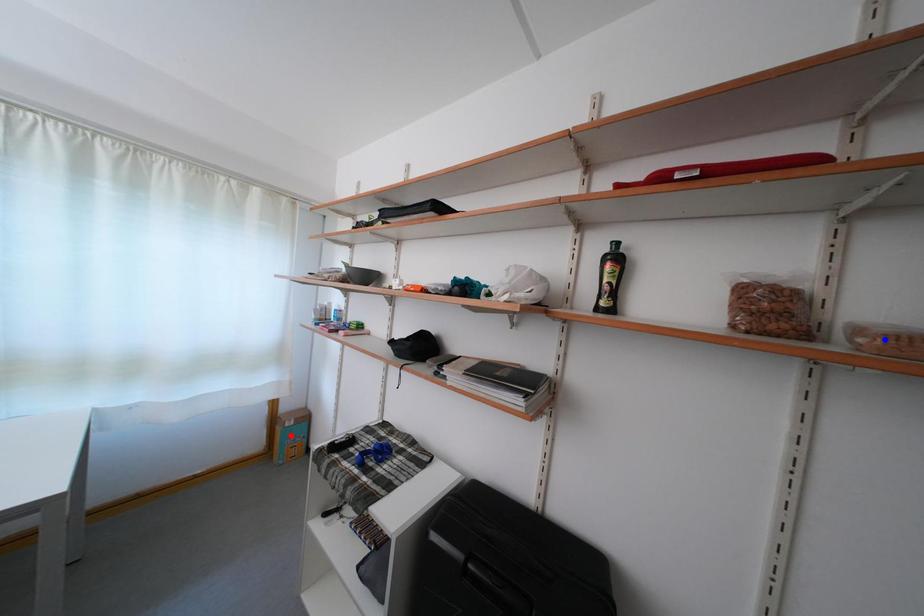
Question: Which of the two points in the image is closer to the camera?

Choices:
 (A) Blue point is closer.
 (B) Red point is closer.

Answer: (A)